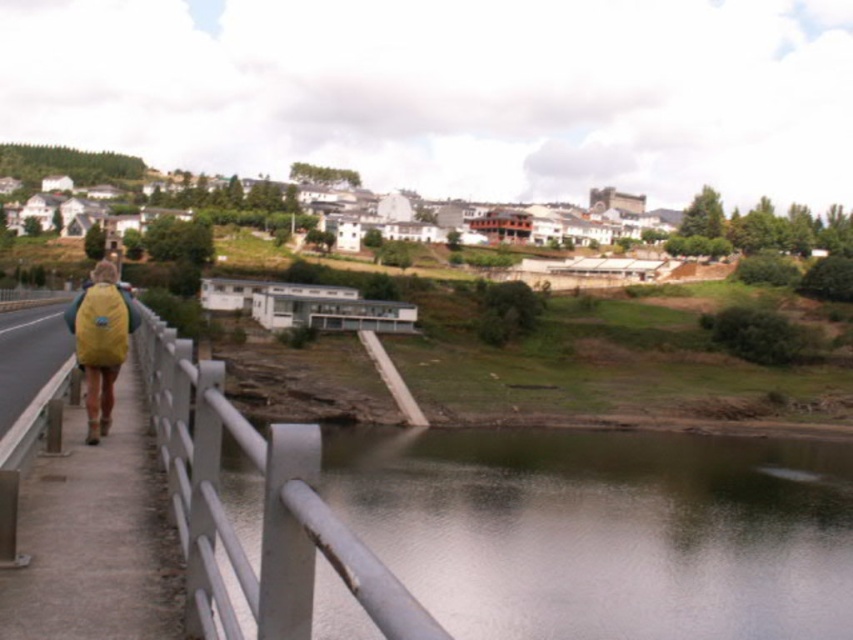
Looking at this image, you are a hiker standing on the path near the white metallic rail at left. You want to take a photo of the greenish reflective water at lower center. Which object should you aim your camera upwards or downwards to capture?

Since the greenish reflective water at lower center is taller than the white metallic rail at left, you should aim your camera upwards to capture the greenish reflective water at lower center.

You are a hiker who just finished your walk and want to place your yellow fabric backpack at left on the concrete sidewalk at left. Can you fit the backpack on the sidewalk?

The concrete sidewalk at left is smaller than the yellow fabric backpack at left, so the backpack will not fit on the sidewalk.

Consider the image. You are standing at the starting point of the path and want to reach the buildings on the hill. The greenish reflective water at lower center and the yellow fabric backpack at left are in your line of sight. Which object should you focus on to determine your direction towards the buildings?

You should focus on the yellow fabric backpack at left because the greenish reflective water at lower center is in front of the yellow fabric backpack at left, indicating the backpack is closer to you. Since the person with the backpack is walking towards the buildings, following their direction would lead you towards the hill.